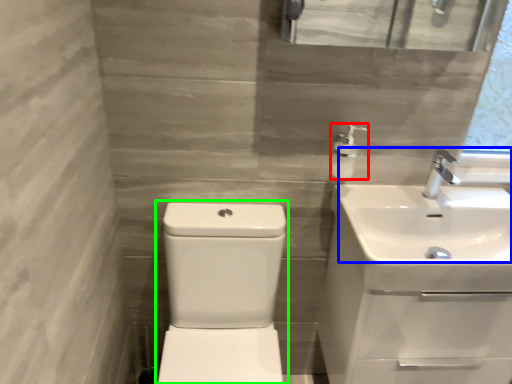
Question: Estimate the real-world distances between objects in this image. Which object is closer to soap dispenser (highlighted by a red box), sink (highlighted by a blue box) or sink (highlighted by a green box)?

Choices:
 (A) sink
 (B) sink

Answer: (A)